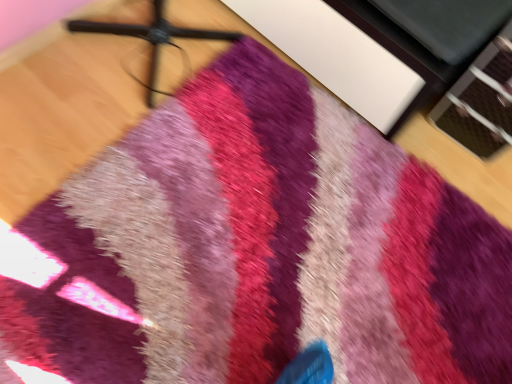
Question: Considering the relative positions of black plastic tripod at upper center and white matte cabinet at upper center in the image provided, is black plastic tripod at upper center in front of white matte cabinet at upper center?

Choices:
 (A) yes
 (B) no

Answer: (A)

Question: Does black plastic tripod at upper center turn towards white matte cabinet at upper center?

Choices:
 (A) no
 (B) yes

Answer: (A)

Question: Is black plastic tripod at upper center shorter than white matte cabinet at upper center?

Choices:
 (A) yes
 (B) no

Answer: (B)

Question: From a real-world perspective, is black plastic tripod at upper center physically below white matte cabinet at upper center?

Choices:
 (A) yes
 (B) no

Answer: (B)

Question: Considering the relative sizes of black plastic tripod at upper center and white matte cabinet at upper center in the image provided, is black plastic tripod at upper center wider than white matte cabinet at upper center?

Choices:
 (A) yes
 (B) no

Answer: (B)

Question: Is white matte cabinet at upper center at the back of black plastic tripod at upper center?

Choices:
 (A) yes
 (B) no

Answer: (B)

Question: From a real-world perspective, is white matte cabinet at upper center over black plastic tripod at upper center?

Choices:
 (A) no
 (B) yes

Answer: (A)

Question: Does white matte cabinet at upper center appear on the right side of black plastic tripod at upper center?

Choices:
 (A) no
 (B) yes

Answer: (B)

Question: Considering the relative sizes of white matte cabinet at upper center and black plastic tripod at upper center in the image provided, is white matte cabinet at upper center bigger than black plastic tripod at upper center?

Choices:
 (A) no
 (B) yes

Answer: (B)

Question: Is black plastic tripod at upper center completely or partially inside white matte cabinet at upper center?

Choices:
 (A) no
 (B) yes

Answer: (A)

Question: Is white matte cabinet at upper center next to black plastic tripod at upper center and touching it?

Choices:
 (A) yes
 (B) no

Answer: (B)

Question: Does white matte cabinet at upper center have a smaller size compared to black plastic tripod at upper center?

Choices:
 (A) no
 (B) yes

Answer: (A)

Question: Is point (306, 33) closer or farther from the camera than point (96, 28)?

Choices:
 (A) farther
 (B) closer

Answer: (B)